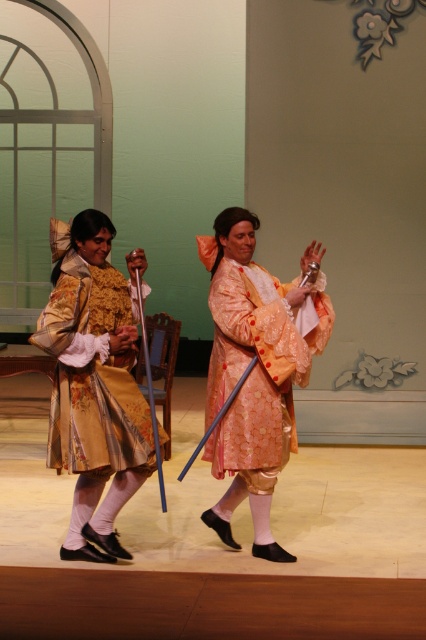
Question: Considering the relative positions of gold brocade dress at center and matte peach robe at center in the image provided, where is gold brocade dress at center located with respect to matte peach robe at center?

Choices:
 (A) left
 (B) right

Answer: (A)

Question: Which object appears farthest from the camera in this image?

Choices:
 (A) gold brocade dress at center
 (B) matte peach robe at center

Answer: (B)

Question: Is gold brocade dress at center to the left of matte peach robe at center from the viewer's perspective?

Choices:
 (A) no
 (B) yes

Answer: (B)

Question: Does gold brocade dress at center have a smaller size compared to matte peach robe at center?

Choices:
 (A) no
 (B) yes

Answer: (A)